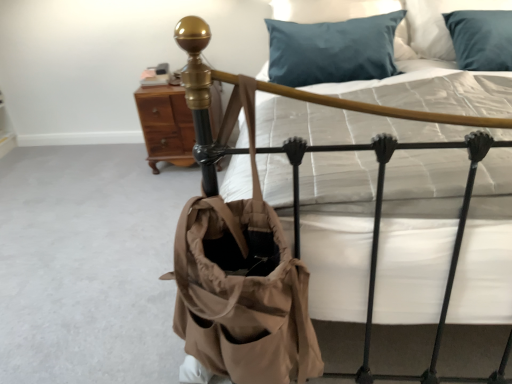
Question: Is brown wood nightstand at upper left outside tan canvas tote at center?

Choices:
 (A) no
 (B) yes

Answer: (B)

Question: Is brown wood nightstand at upper left far from tan canvas tote at center?

Choices:
 (A) no
 (B) yes

Answer: (B)

Question: From the image's perspective, is brown wood nightstand at upper left located beneath tan canvas tote at center?

Choices:
 (A) no
 (B) yes

Answer: (A)

Question: Considering the relative positions of brown wood nightstand at upper left and tan canvas tote at center in the image provided, is brown wood nightstand at upper left behind tan canvas tote at center?

Choices:
 (A) yes
 (B) no

Answer: (A)

Question: Is brown wood nightstand at upper left next to tan canvas tote at center?

Choices:
 (A) no
 (B) yes

Answer: (A)

Question: Is teal satin pillow at upper center to the left or to the right of tan canvas tote at center in the image?

Choices:
 (A) right
 (B) left

Answer: (A)

Question: From the image's perspective, relative to tan canvas tote at center, is teal satin pillow at upper center above or below?

Choices:
 (A) above
 (B) below

Answer: (A)

Question: Is teal satin pillow at upper center taller or shorter than tan canvas tote at center?

Choices:
 (A) short
 (B) tall

Answer: (A)

Question: From a real-world perspective, relative to tan canvas tote at center, is teal satin pillow at upper center vertically above or below?

Choices:
 (A) below
 (B) above

Answer: (B)

Question: From a real-world perspective, relative to white quilted mattress at center, is teal satin pillow at upper center vertically above or below?

Choices:
 (A) below
 (B) above

Answer: (B)

Question: In terms of width, does teal satin pillow at upper center look wider or thinner when compared to white quilted mattress at center?

Choices:
 (A) wide
 (B) thin

Answer: (B)

Question: From the image's perspective, is teal satin pillow at upper center above or below white quilted mattress at center?

Choices:
 (A) below
 (B) above

Answer: (B)

Question: Based on their positions, is teal satin pillow at upper center located to the left or right of white quilted mattress at center?

Choices:
 (A) right
 (B) left

Answer: (B)

Question: From the image's perspective, is brown wood nightstand at upper left located above or below white quilted mattress at center?

Choices:
 (A) below
 (B) above

Answer: (B)

Question: Looking at their shapes, would you say brown wood nightstand at upper left is wider or thinner than white quilted mattress at center?

Choices:
 (A) wide
 (B) thin

Answer: (B)